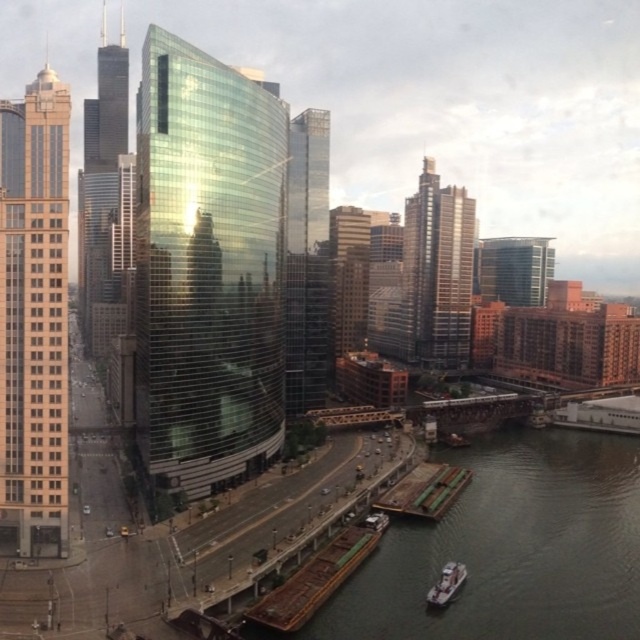
The width and height of the screenshot is (640, 640). Describe the element at coordinates (208, 268) in the screenshot. I see `shiny glass skyscraper at center` at that location.

Measure the distance between shiny glass skyscraper at center and camera.

They are 120.48 meters apart.

Image resolution: width=640 pixels, height=640 pixels. I want to click on shiny glass skyscraper at center, so click(208, 268).

Does shiny glass skyscraper at center have a greater height compared to glassy reflective skyscraper at center?

Correct, shiny glass skyscraper at center is much taller as glassy reflective skyscraper at center.

Measure the distance between shiny glass skyscraper at center and camera.

shiny glass skyscraper at center is 120.48 meters away from camera.

Looking at this image, who is more forward, (189,282) or (483,289)?

Positioned in front is point (189,282).

Where is `shiny glass skyscraper at center`? The height and width of the screenshot is (640, 640). shiny glass skyscraper at center is located at coordinates (208, 268).

Does green metallic river at lower center appear under brown wooden dock at lower right?

Indeed, green metallic river at lower center is positioned under brown wooden dock at lower right.

Does point (620, 541) lie in front of point (451, 484)?

Yes, point (620, 541) is in front of point (451, 484).

What do you see at coordinates (509, 548) in the screenshot? I see `green metallic river at lower center` at bounding box center [509, 548].

What are the coordinates of `green metallic river at lower center` in the screenshot? It's located at (509, 548).